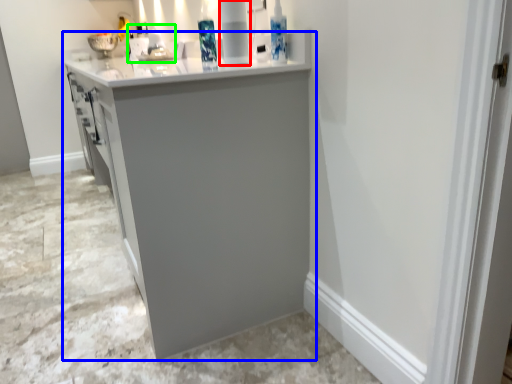
Question: Based on their relative distances, which object is nearer to appliance (highlighted by a red box)? Choose from cabinetry (highlighted by a blue box) and sink (highlighted by a green box).

Choices:
 (A) cabinetry
 (B) sink

Answer: (A)